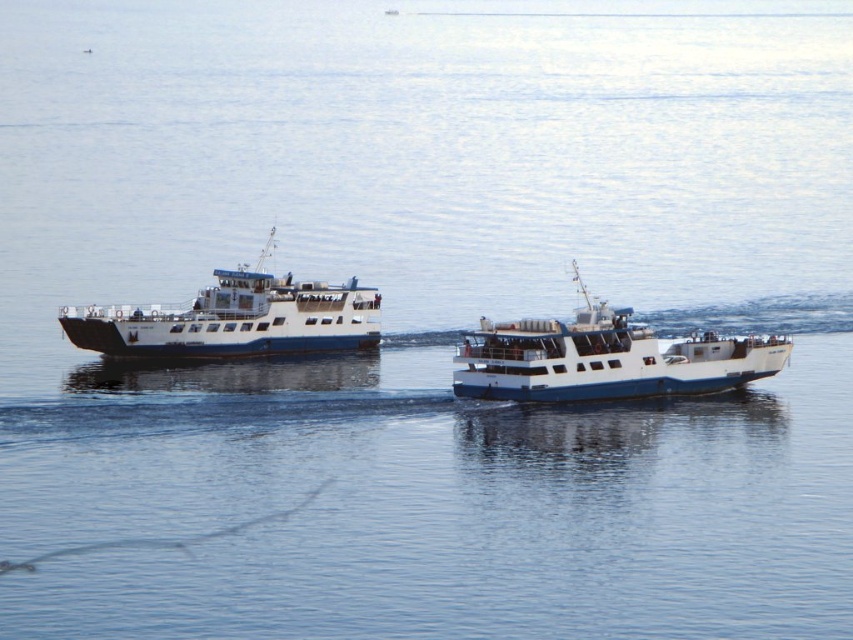
Does white matte boat at center have a lesser height compared to white matte ferry at left?

Indeed, white matte boat at center has a lesser height compared to white matte ferry at left.

How much distance is there between white matte boat at center and white matte ferry at left?

The distance of white matte boat at center from white matte ferry at left is 12.01 meters.

Measure the distance between white matte boat at center and camera.

66.08 meters

Locate an element on the screen. white matte boat at center is located at coordinates (604, 358).